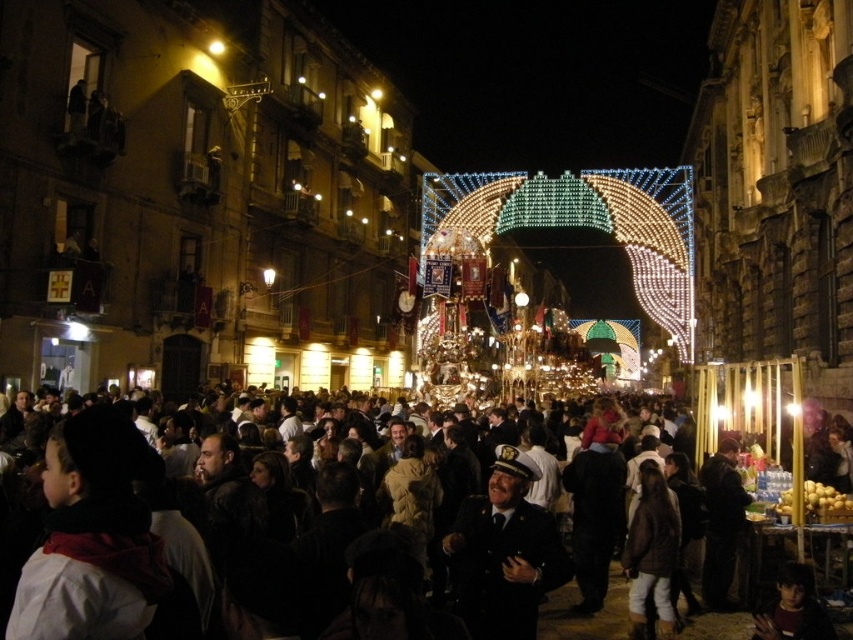
You are a photographer trying to capture the grand illuminated structure in the center of the scene. You notice the black uniform at center and the dark brown fabric crowd at center. Which of these two objects is wider in the image?

The dark brown fabric crowd at center is wider than the black uniform at center in the image.

You are a photographer standing on the street and want to capture both the black uniform at center and the dark brown fabric crowd at center in a single shot. Since the crowd is moving, you need to know their relative positions to frame the shot properly. Which object is positioned to the right of the other?

The black uniform at center is to the right of dark brown fabric crowd at center.